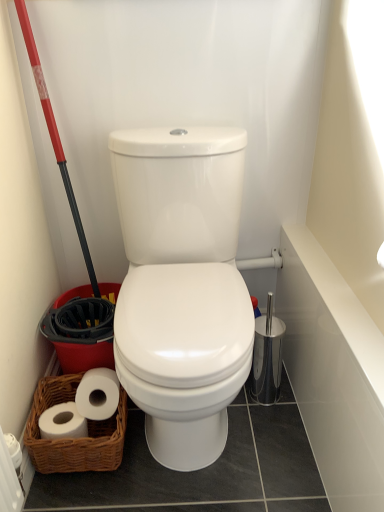
Question: Does woven brown basket at lower left turn towards white glossy bath at upper right?

Choices:
 (A) yes
 (B) no

Answer: (B)

Question: Is woven brown basket at lower left smaller than white glossy bath at upper right?

Choices:
 (A) yes
 (B) no

Answer: (B)

Question: Is woven brown basket at lower left to the left of white glossy bath at upper right from the viewer's perspective?

Choices:
 (A) yes
 (B) no

Answer: (A)

Question: Can you confirm if woven brown basket at lower left is thinner than white glossy bath at upper right?

Choices:
 (A) yes
 (B) no

Answer: (B)

Question: Is woven brown basket at lower left positioned with its back to white glossy bath at upper right?

Choices:
 (A) no
 (B) yes

Answer: (A)

Question: Is the position of woven brown basket at lower left less distant than that of white glossy bath at upper right?

Choices:
 (A) no
 (B) yes

Answer: (A)

Question: From the image's perspective, is red plastic shovel at left below white glossy bath at upper right?

Choices:
 (A) yes
 (B) no

Answer: (B)

Question: Considering the relative positions of red plastic shovel at left and white glossy bath at upper right in the image provided, is red plastic shovel at left in front of white glossy bath at upper right?

Choices:
 (A) no
 (B) yes

Answer: (A)

Question: Does red plastic shovel at left have a lesser height compared to white glossy bath at upper right?

Choices:
 (A) yes
 (B) no

Answer: (B)

Question: Is red plastic shovel at left at the right side of white glossy bath at upper right?

Choices:
 (A) yes
 (B) no

Answer: (B)

Question: Is red plastic shovel at left further to camera compared to white glossy bath at upper right?

Choices:
 (A) no
 (B) yes

Answer: (B)

Question: From a real-world perspective, does red plastic shovel at left sit lower than white glossy bath at upper right?

Choices:
 (A) no
 (B) yes

Answer: (A)

Question: From the image's perspective, does white glossy bath at upper right appear higher than red plastic shovel at left?

Choices:
 (A) no
 (B) yes

Answer: (A)